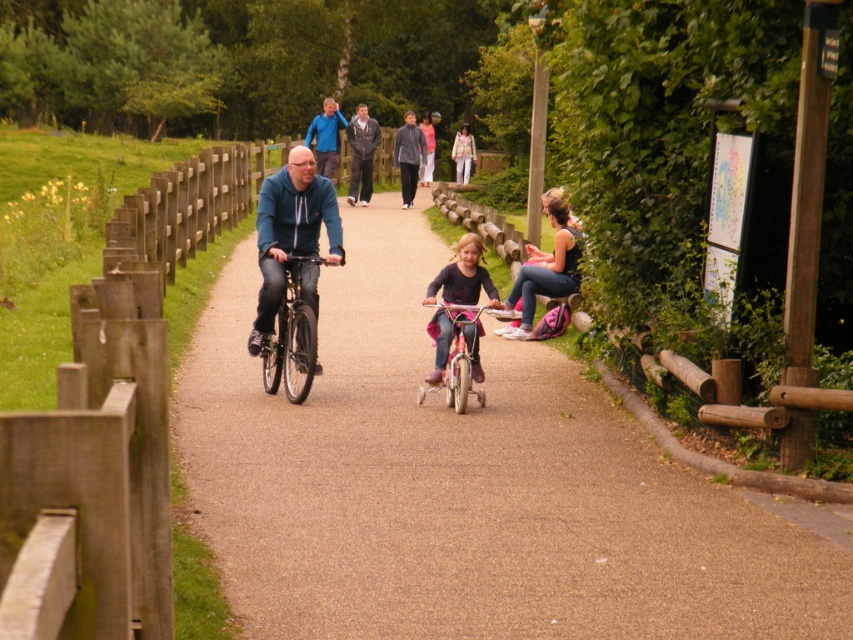
Is blue fleece jacket at upper center bigger than light beige fabric jacket at upper center?

Yes, blue fleece jacket at upper center is bigger than light beige fabric jacket at upper center.

Can you confirm if blue fleece jacket at upper center is positioned below light beige fabric jacket at upper center?

Correct, blue fleece jacket at upper center is located below light beige fabric jacket at upper center.

Describe the element at coordinates (409, 154) in the screenshot. I see `blue fleece jacket at upper center` at that location.

At what (x,y) coordinates should I click in order to perform the action: click on blue fleece jacket at upper center. Please return your answer as a coordinate pair (x, y). This screenshot has height=640, width=853. Looking at the image, I should click on (409, 154).

This screenshot has height=640, width=853. What are the coordinates of `matte blue jacket at center` in the screenshot? It's located at (292, 236).

Is point (303, 176) closer to camera compared to point (543, 257)?

Yes, it is in front of point (543, 257).

Between point (277, 234) and point (544, 266), which one is positioned in front?

Point (277, 234) is in front.

Where is `matte blue jacket at center`? The image size is (853, 640). matte blue jacket at center is located at coordinates (292, 236).

Does matte blue jacket at center have a greater width compared to pink matte bicycle at center?

Indeed, matte blue jacket at center has a greater width compared to pink matte bicycle at center.

Between matte blue jacket at center and pink matte bicycle at center, which one is positioned higher?

matte blue jacket at center

The image size is (853, 640). Identify the location of matte blue jacket at center. (292, 236).